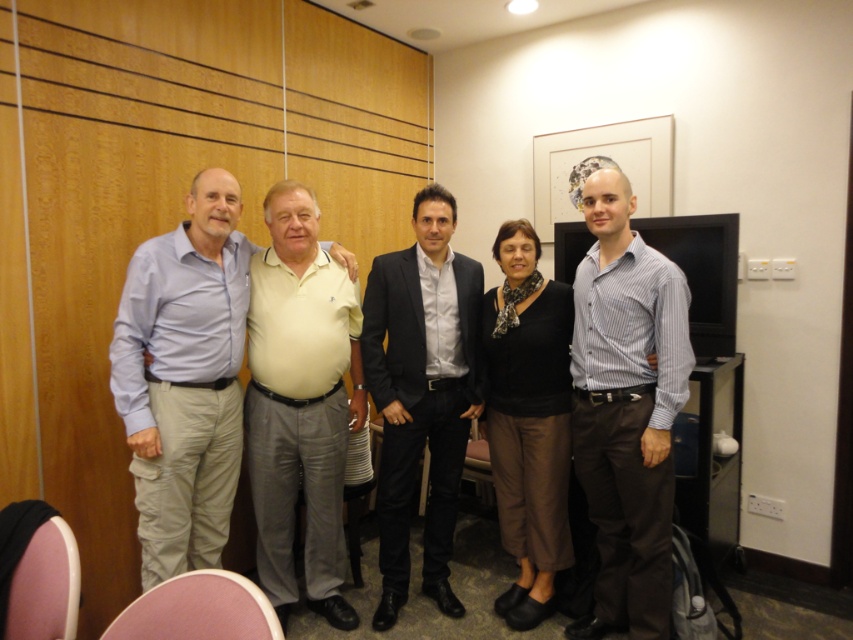
Question: Which point is farther to the camera?

Choices:
 (A) (529, 616)
 (B) (305, 477)

Answer: (A)

Question: Where is light blue shirt at left located in relation to striped cotton shirt at right in the image?

Choices:
 (A) below
 (B) above

Answer: (B)

Question: Is striped cotton shirt at right wider than black matte sweater at center?

Choices:
 (A) no
 (B) yes

Answer: (A)

Question: Which point appears farthest from the camera in this image?

Choices:
 (A) (576, 380)
 (B) (546, 326)

Answer: (B)

Question: Which object is positioned closest to the light yellow polo shirt at center?

Choices:
 (A) light blue shirt at left
 (B) dark gray suit at center

Answer: (A)

Question: Can you confirm if light yellow polo shirt at center is wider than black matte sweater at center?

Choices:
 (A) no
 (B) yes

Answer: (B)